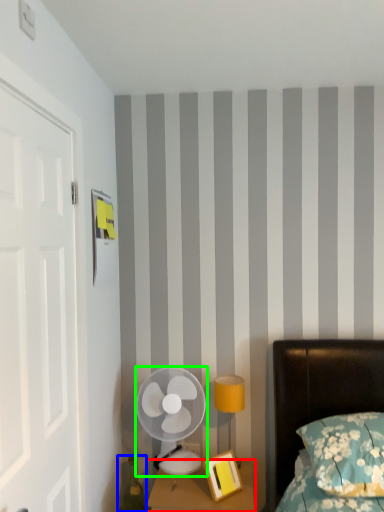
Question: Which object is the closest to the nightstand (highlighted by a red box)? Choose among these: teal (highlighted by a blue box) or mechanical fan (highlighted by a green box).

Choices:
 (A) teal
 (B) mechanical fan

Answer: (B)